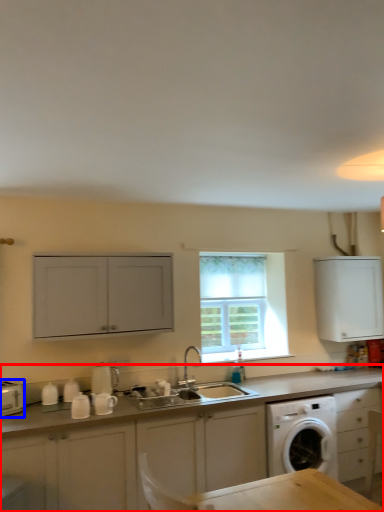
Question: Which object is closer to the camera taking this photo, cabinetry (highlighted by a red box) or appliance (highlighted by a blue box)?

Choices:
 (A) cabinetry
 (B) appliance

Answer: (A)